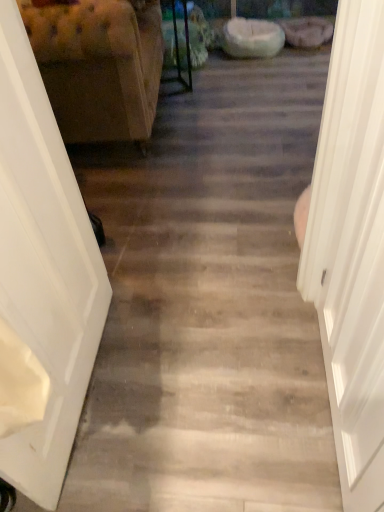
Image resolution: width=384 pixels, height=512 pixels. What do you see at coordinates (99, 67) in the screenshot?
I see `tufted fabric armchair at left` at bounding box center [99, 67].

This screenshot has height=512, width=384. Find the location of `tufted fabric armchair at left`. tufted fabric armchair at left is located at coordinates (99, 67).

I want to click on white smooth door at right, placed as the 2th door when sorted from left to right, so click(351, 248).

What are the coordinates of `tufted fabric armchair at left` in the screenshot? It's located at (99, 67).

Which of these two, tufted fabric armchair at left or white smooth door at right, placed as the 2th door when sorted from left to right, is thinner?

white smooth door at right, placed as the 2th door when sorted from left to right, is thinner.

Considering the points (125, 0) and (347, 182), which point is in front, point (125, 0) or point (347, 182)?

The point (347, 182) is closer to the camera.

From a real-world perspective, does tufted fabric armchair at left sit lower than white smooth door at right, placed as the 2th door when sorted from left to right?

Yes, from a real-world perspective, tufted fabric armchair at left is under white smooth door at right, placed as the 2th door when sorted from left to right.

Looking at this image, is tufted fabric armchair at left positioned far away from white smooth door at right, the 1th door viewed from the right?

Yes, tufted fabric armchair at left is far from white smooth door at right, the 1th door viewed from the right.

Considering the positions of objects tufted fabric armchair at left and white glossy door at left, positioned as the second door in right-to-left order, in the image provided, who is behind, tufted fabric armchair at left or white glossy door at left, positioned as the second door in right-to-left order,?

tufted fabric armchair at left is more distant.

Locate an element on the screen. This screenshot has height=512, width=384. door that is the 1st one above the tufted fabric armchair at left (from a real-world perspective) is located at coordinates (41, 280).

Is white glossy door at left, the 1th door viewed from the left, oriented away from tufted fabric armchair at left?

white glossy door at left, the 1th door viewed from the left, is not turned away from tufted fabric armchair at left.

Would you consider white glossy door at left, positioned as the second door in right-to-left order, to be distant from tufted fabric armchair at left?

Yes.

Is tufted fabric armchair at left inside white glossy door at left, positioned as the second door in right-to-left order?

No, tufted fabric armchair at left is not surrounded by white glossy door at left, positioned as the second door in right-to-left order.

From a real-world perspective, which object stands above the other?

white glossy door at left, positioned as the second door in right-to-left order.

From a real-world perspective, who is located lower, white smooth door at right, placed as the 2th door when sorted from left to right, or tufted fabric armchair at left?

tufted fabric armchair at left.

Consider the image. Which of these two, white smooth door at right, placed as the 2th door when sorted from left to right, or tufted fabric armchair at left, is thinner?

Thinner between the two is white smooth door at right, placed as the 2th door when sorted from left to right.

How far apart are white smooth door at right, the 1th door viewed from the right, and tufted fabric armchair at left?

A distance of 4.46 feet exists between white smooth door at right, the 1th door viewed from the right, and tufted fabric armchair at left.

Can you tell me how much white smooth door at right, the 1th door viewed from the right, and tufted fabric armchair at left differ in facing direction?

The angle between the facing direction of white smooth door at right, the 1th door viewed from the right, and the facing direction of tufted fabric armchair at left is 177 degrees.

Can you tell me how much white smooth door at right, placed as the 2th door when sorted from left to right, and white glossy door at left, positioned as the second door in right-to-left order, differ in facing direction?

The angle between the facing direction of white smooth door at right, placed as the 2th door when sorted from left to right, and the facing direction of white glossy door at left, positioned as the second door in right-to-left order, is 179 degrees.

Considering the sizes of objects white smooth door at right, placed as the 2th door when sorted from left to right, and white glossy door at left, the 1th door viewed from the left, in the image provided, who is bigger, white smooth door at right, placed as the 2th door when sorted from left to right, or white glossy door at left, the 1th door viewed from the left,?

Bigger between the two is white smooth door at right, placed as the 2th door when sorted from left to right.

Where is `door positioned vertically above the white glossy door at left, positioned as the second door in right-to-left order (from a real-world perspective)`? Image resolution: width=384 pixels, height=512 pixels. door positioned vertically above the white glossy door at left, positioned as the second door in right-to-left order (from a real-world perspective) is located at coordinates (351, 248).

Consider the image. Considering the sizes of white smooth door at right, the 1th door viewed from the right, and white glossy door at left, the 1th door viewed from the left, in the image, is white smooth door at right, the 1th door viewed from the right, taller or shorter than white glossy door at left, the 1th door viewed from the left,?

white smooth door at right, the 1th door viewed from the right, is taller than white glossy door at left, the 1th door viewed from the left.

From a real-world perspective, is white glossy door at left, positioned as the second door in right-to-left order, positioned above or below white smooth door at right, the 1th door viewed from the right?

white glossy door at left, positioned as the second door in right-to-left order, is below white smooth door at right, the 1th door viewed from the right.

In the image, is white glossy door at left, the 1th door viewed from the left, positioned in front of or behind white smooth door at right, placed as the 2th door when sorted from left to right?

In the image, white glossy door at left, the 1th door viewed from the left, appears behind white smooth door at right, placed as the 2th door when sorted from left to right.

Considering the positions of point (50, 488) and point (314, 264), is point (50, 488) closer or farther from the camera than point (314, 264)?

Point (50, 488) is closer to the camera than point (314, 264).

Find the location of `door on the left of white smooth door at right, the 1th door viewed from the right`. door on the left of white smooth door at right, the 1th door viewed from the right is located at coordinates (41, 280).

I want to click on furniture that appears behind the white smooth door at right, placed as the 2th door when sorted from left to right, so click(x=99, y=67).

Locate an element on the screen. This screenshot has height=512, width=384. furniture above the white glossy door at left, positioned as the second door in right-to-left order (from the image's perspective) is located at coordinates (99, 67).

Looking at this image, when comparing their distances from white smooth door at right, the 1th door viewed from the right, does white glossy door at left, the 1th door viewed from the left, or tufted fabric armchair at left seem closer?

Result: Among the two, white glossy door at left, the 1th door viewed from the left, is located nearer to white smooth door at right, the 1th door viewed from the right.

Based on their spatial positions, is tufted fabric armchair at left or white glossy door at left, positioned as the second door in right-to-left order, closer to white smooth door at right, the 1th door viewed from the right?

white glossy door at left, positioned as the second door in right-to-left order.

Based on their spatial positions, is white smooth door at right, the 1th door viewed from the right, or white glossy door at left, positioned as the second door in right-to-left order, closer to tufted fabric armchair at left?

Based on the image, white glossy door at left, positioned as the second door in right-to-left order, appears to be nearer to tufted fabric armchair at left.

From the image, which object appears to be nearer to white glossy door at left, the 1th door viewed from the left, tufted fabric armchair at left or white smooth door at right, placed as the 2th door when sorted from left to right?

Based on the image, white smooth door at right, placed as the 2th door when sorted from left to right, appears to be nearer to white glossy door at left, the 1th door viewed from the left.

Considering their positions, is white smooth door at right, placed as the 2th door when sorted from left to right, positioned further to white glossy door at left, positioned as the second door in right-to-left order, than tufted fabric armchair at left?

Among the two, tufted fabric armchair at left is located further to white glossy door at left, positioned as the second door in right-to-left order.

Looking at the image, which one is located further to tufted fabric armchair at left, white glossy door at left, positioned as the second door in right-to-left order, or white smooth door at right, placed as the 2th door when sorted from left to right?

Based on the image, white smooth door at right, placed as the 2th door when sorted from left to right, appears to be further to tufted fabric armchair at left.

At what (x,y) coordinates should I click in order to perform the action: click on door between tufted fabric armchair at left and white glossy door at left, the 1th door viewed from the left, from top to bottom. Please return your answer as a coordinate pair (x, y). The image size is (384, 512). Looking at the image, I should click on (351, 248).